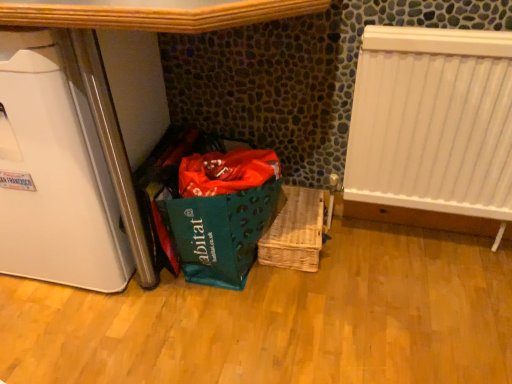
Where is `vacant area that lies in front of white plastic radiator at right`? vacant area that lies in front of white plastic radiator at right is located at coordinates (422, 299).